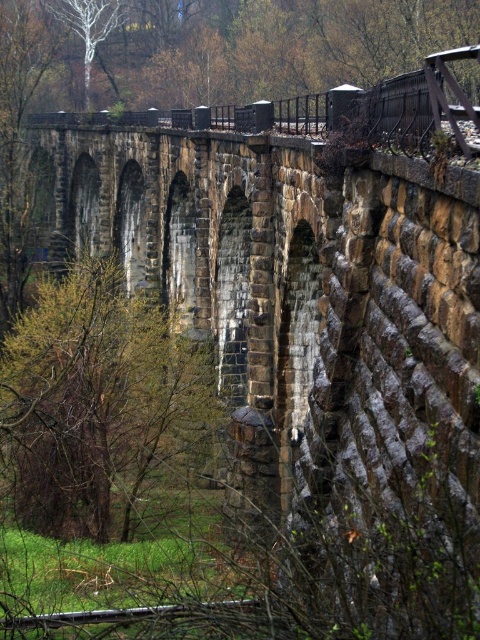
Question: Among these objects, which one is farthest from the camera?

Choices:
 (A) white smooth tree at upper left
 (B) smooth metal train track at lower center
 (C) green leafy tree at center

Answer: (A)

Question: Is green leafy tree at center below white smooth tree at upper left?

Choices:
 (A) no
 (B) yes

Answer: (B)

Question: Among these objects, which one is nearest to the camera?

Choices:
 (A) white smooth tree at upper left
 (B) green leafy tree at center
 (C) smooth metal train track at lower center

Answer: (C)

Question: Which of these objects is positioned farthest from the green leafy tree at center?

Choices:
 (A) white smooth tree at upper left
 (B) smooth metal train track at lower center

Answer: (A)

Question: Is green leafy tree at center above smooth metal train track at lower center?

Choices:
 (A) no
 (B) yes

Answer: (B)

Question: Does smooth metal train track at lower center have a smaller size compared to white smooth tree at upper left?

Choices:
 (A) yes
 (B) no

Answer: (A)